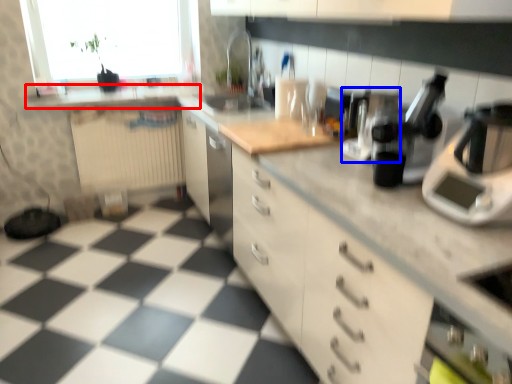
Question: Which of the following is the closest to the observer, counter top (highlighted by a red box) or coffee machine (highlighted by a blue box)?

Choices:
 (A) counter top
 (B) coffee machine

Answer: (B)